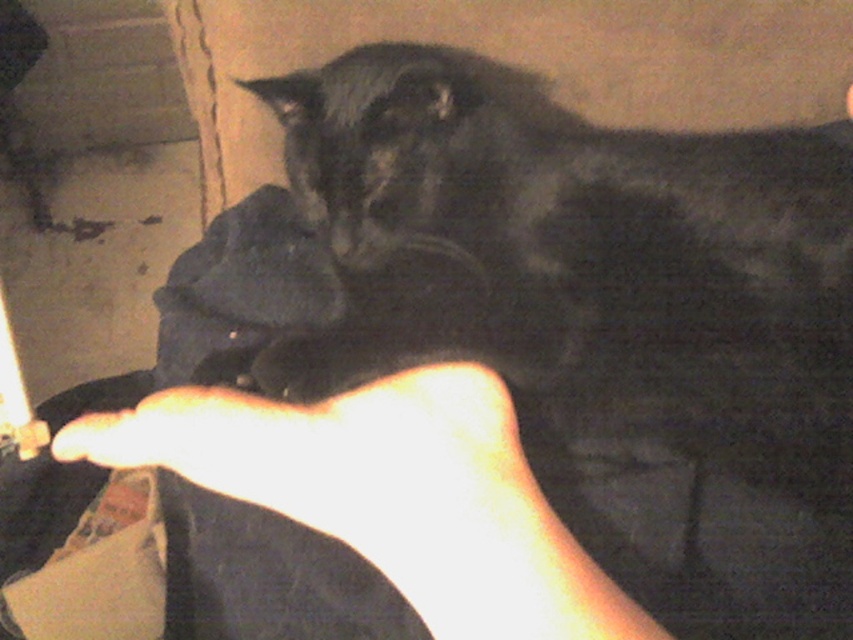
Can you confirm if black fur cat at center is smaller than light skin tone flesh at lower center?

No.

Find the location of a particular element. The image size is (853, 640). black fur cat at center is located at coordinates (599, 252).